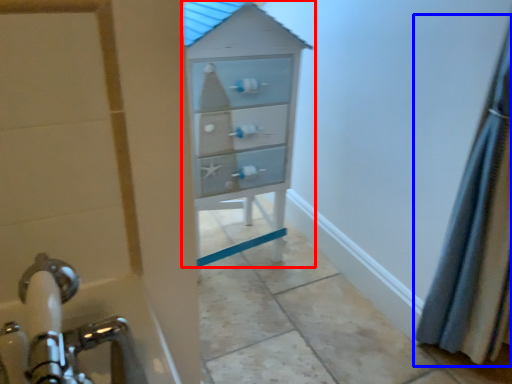
Question: Among these objects, which one is farthest to the camera, chest of drawers (highlighted by a red box) or shower curtain (highlighted by a blue box)?

Choices:
 (A) chest of drawers
 (B) shower curtain

Answer: (A)